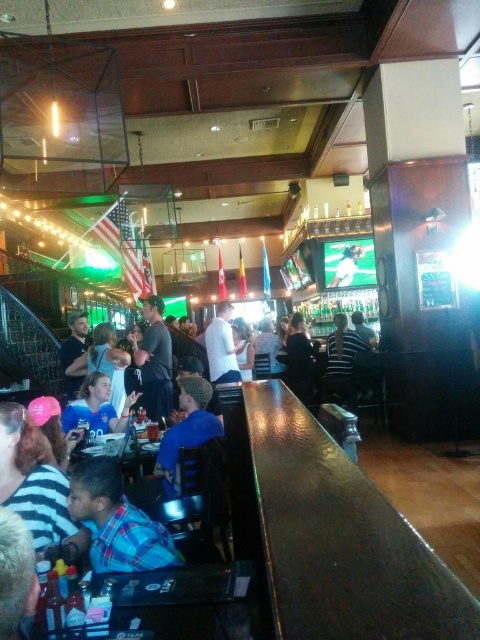
Can you confirm if shiny brown wood bar at center is positioned to the right of plaid shirt at lower left?

Correct, you'll find shiny brown wood bar at center to the right of plaid shirt at lower left.

Who is higher up, shiny brown wood bar at center or plaid shirt at lower left?

Positioned higher is plaid shirt at lower left.

What do you see at coordinates (331, 534) in the screenshot? I see `shiny brown wood bar at center` at bounding box center [331, 534].

The image size is (480, 640). I want to click on shiny brown wood bar at center, so click(331, 534).

Is point (136, 602) behind point (55, 515)?

No.

This screenshot has width=480, height=640. Find the location of `wooden table at lower center`. wooden table at lower center is located at coordinates (181, 600).

Does point (132, 608) come closer to viewer compared to point (38, 512)?

Yes, it is.

This screenshot has width=480, height=640. Find the location of `wooden table at lower center`. wooden table at lower center is located at coordinates (181, 600).

Does wooden table at lower center have a larger size compared to green fabric shirt at center?

Indeed, wooden table at lower center has a larger size compared to green fabric shirt at center.

Does point (194, 566) lie behind point (338, 280)?

No, it is in front of (338, 280).

Where is `wooden table at lower center`? wooden table at lower center is located at coordinates (181, 600).